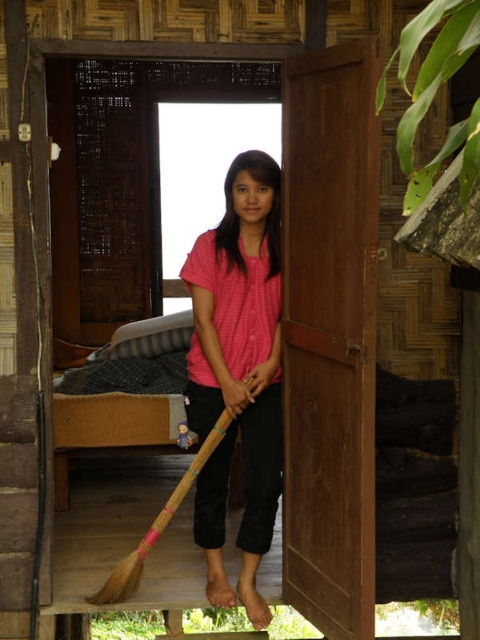
Question: In this image, where is pink matte shirt at center located relative to bamboo broom at center?

Choices:
 (A) right
 (B) left

Answer: (A)

Question: Which point appears farthest from the camera in this image?

Choices:
 (A) (320, 134)
 (B) (272, 461)

Answer: (B)

Question: Does pink matte shirt at center have a greater width compared to bamboo broom at center?

Choices:
 (A) yes
 (B) no

Answer: (B)

Question: Does pink matte shirt at center appear on the right side of bamboo broom at center?

Choices:
 (A) no
 (B) yes

Answer: (B)

Question: Among these points, which one is nearest to the camera?

Choices:
 (A) (223, 428)
 (B) (217, 572)

Answer: (A)

Question: Based on their relative distances, which object is farther from the pink matte shirt at center?

Choices:
 (A) bamboo broom at center
 (B) brown wooden door at center

Answer: (A)